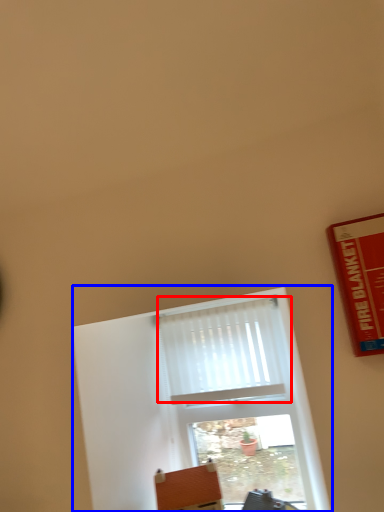
Question: Which object appears closest to the camera in this image, curtain (highlighted by a red box) or window (highlighted by a blue box)?

Choices:
 (A) curtain
 (B) window

Answer: (B)